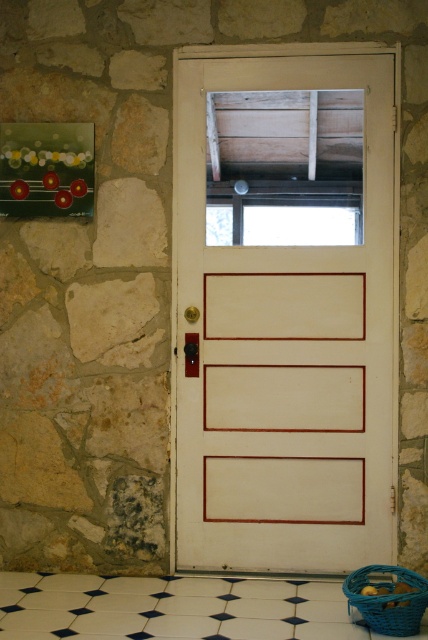
You are standing in the room and want to locate the white painted wood door at center. Based on the coordinates provided, where should you look relative to the stone wall?

The white painted wood door at center is located at coordinates point (285, 346), which means it is positioned towards the right side of the room relative to the stone wall.

You are standing in the room and want to reach the white painted wood door at center. You are currently standing on the white glossy tile at lower center. In which direction should you move to reach the door?

You should move upward to reach the white painted wood door at center because it is located above the white glossy tile at lower center.